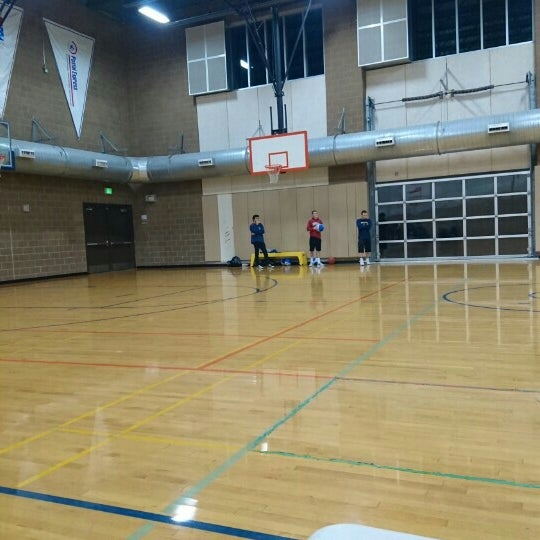
The image size is (540, 540). What are the coordinates of `windows` in the screenshot? It's located at (469, 202), (456, 17), (245, 47).